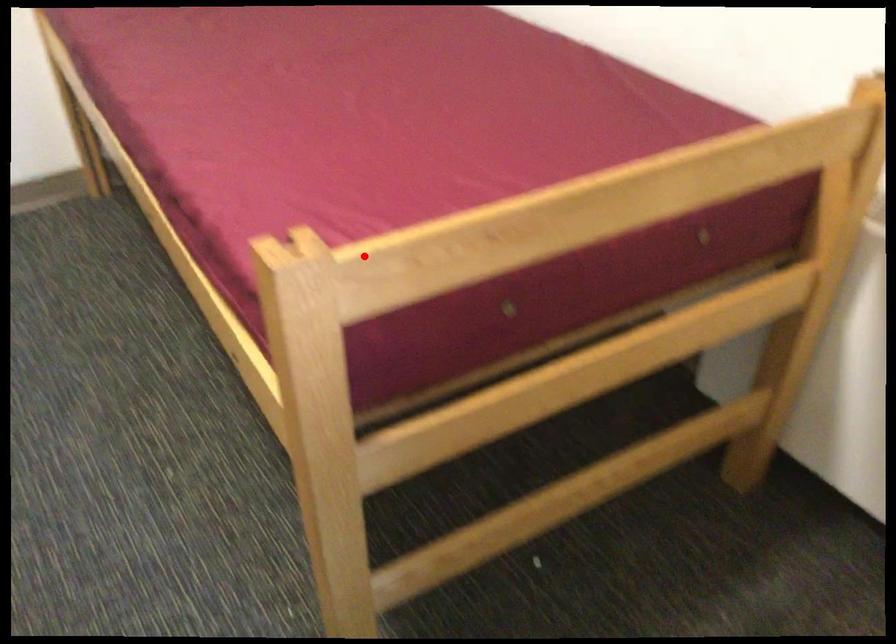
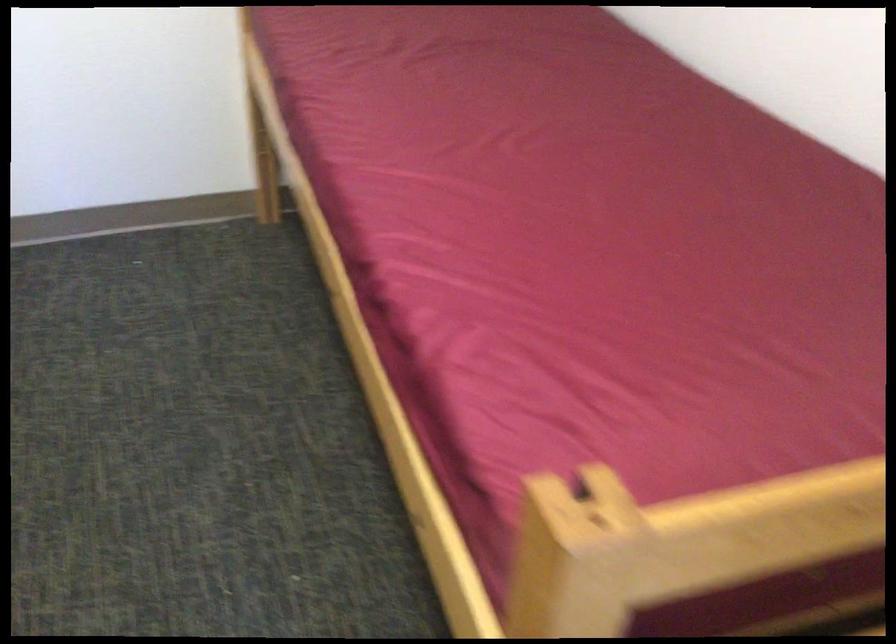
In the second image, find the point that corresponds to the highlighted location in the first image.

(684, 536)